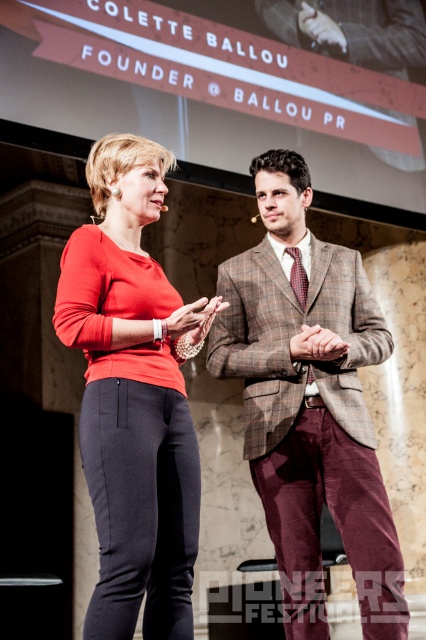
Can you confirm if plaid wool suit at center is thinner than matte red blouse at center?

Incorrect, plaid wool suit at center's width is not less than matte red blouse at center's.

Which is more to the left, plaid wool suit at center or matte red blouse at center?

From the viewer's perspective, matte red blouse at center appears more on the left side.

The height and width of the screenshot is (640, 426). I want to click on plaid wool suit at center, so click(310, 403).